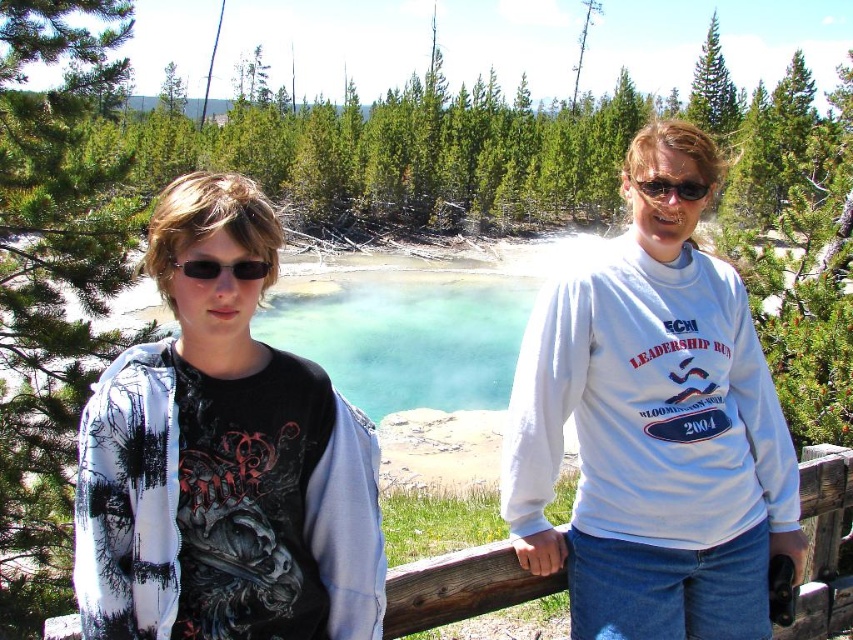
You are a photographer trying to capture both the matte black hoodie at left and the black plastic sunglasses at upper center in a single frame. Which object should you focus on first to ensure both are in the shot?

The matte black hoodie at left is larger in size than the black plastic sunglasses at upper center, so focusing on the matte black hoodie at left first will help ensure both objects are included in the frame.

You are a photographer trying to capture a clear shot of the matte black hoodie at left and the black plastic sunglasses at left. Which object should you focus on first if you want to ensure both are in focus, considering their positions?

The matte black hoodie at left is positioned on the right side of black plastic sunglasses at left, so focusing on the matte black hoodie at left first would help ensure both are in focus since it is closer to the center of the frame.

You are a photographer trying to capture a clear shot of the white cotton shirt at center and the black plastic sunglasses at upper center. Based on their positions, which object should you focus on first to ensure both are in focus?

The white cotton shirt at center is below the black plastic sunglasses at upper center, so focusing on the black plastic sunglasses at upper center first will help ensure both are in focus since it is higher up and closer to the background.